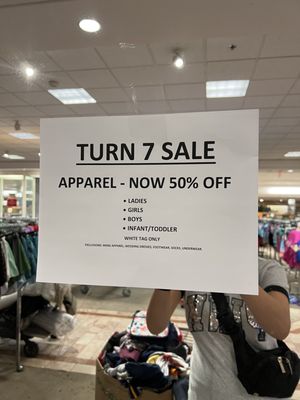
Where is `sheet of paper`? sheet of paper is located at coordinates (91, 213).